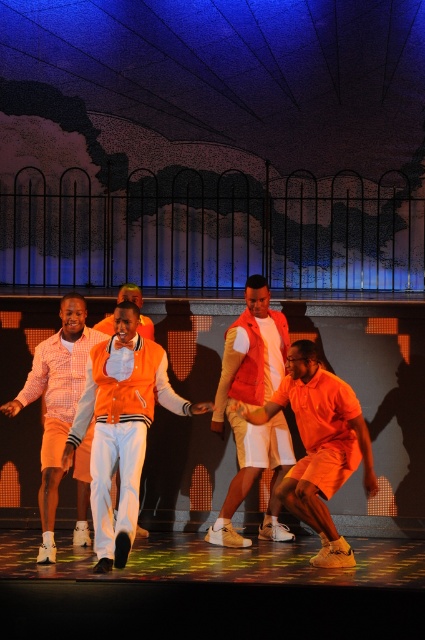
Question: Based on their relative distances, which object is farther from the orange velvety jacket at center?

Choices:
 (A) orange matte shirt at center
 (B) orange cotton shirt at center

Answer: (A)

Question: Among these points, which one is nearest to the camera?

Choices:
 (A) (266, 528)
 (B) (93, 528)
 (C) (51, 476)
 (D) (345, 426)

Answer: (B)

Question: Can you confirm if orange velvety jacket at center is wider than orange matte shirt at center?

Choices:
 (A) yes
 (B) no

Answer: (A)

Question: Can you confirm if orange matte shirt at center is wider than orange matte vest at center?

Choices:
 (A) no
 (B) yes

Answer: (B)

Question: Which point is closer to the camera?

Choices:
 (A) (306, 509)
 (B) (158, 380)
 (C) (64, 417)

Answer: (A)

Question: Observing the image, what is the correct spatial positioning of orange matte shirt at center in reference to orange matte vest at center?

Choices:
 (A) above
 (B) below

Answer: (B)